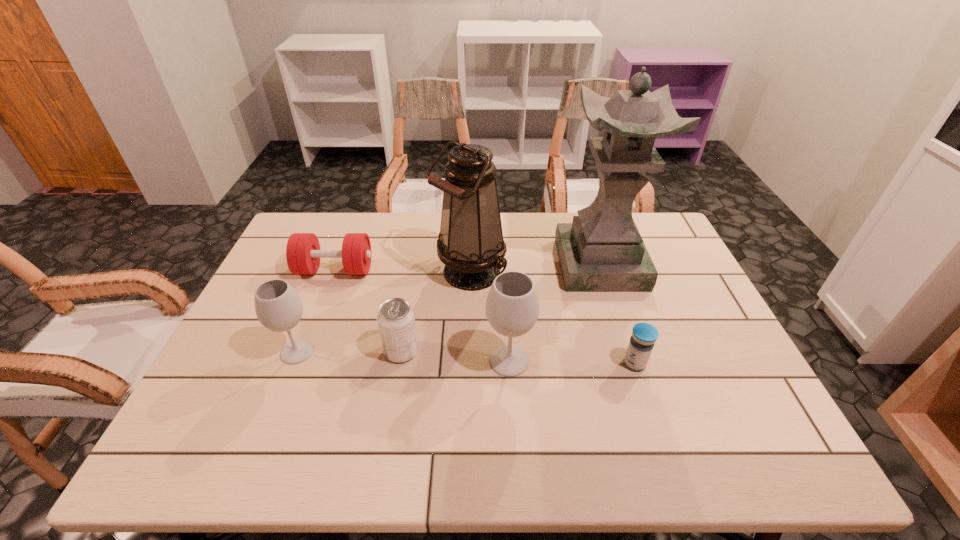
The wineglasss are evenly distributed in the image. To maintain this, where would you place another wineglass on the right? Please point to a free space. Please provide its 2D coordinates. Your answer should be formatted as a tuple, i.e. [(x, y)], where the tuple contains the x and y coordinates of a point satisfying the conditions above.

[(730, 370)]